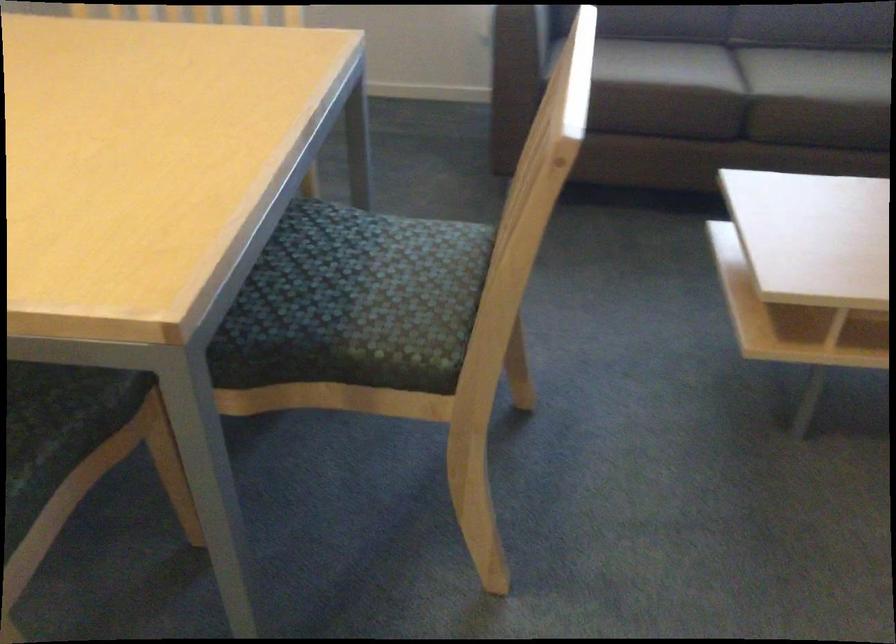
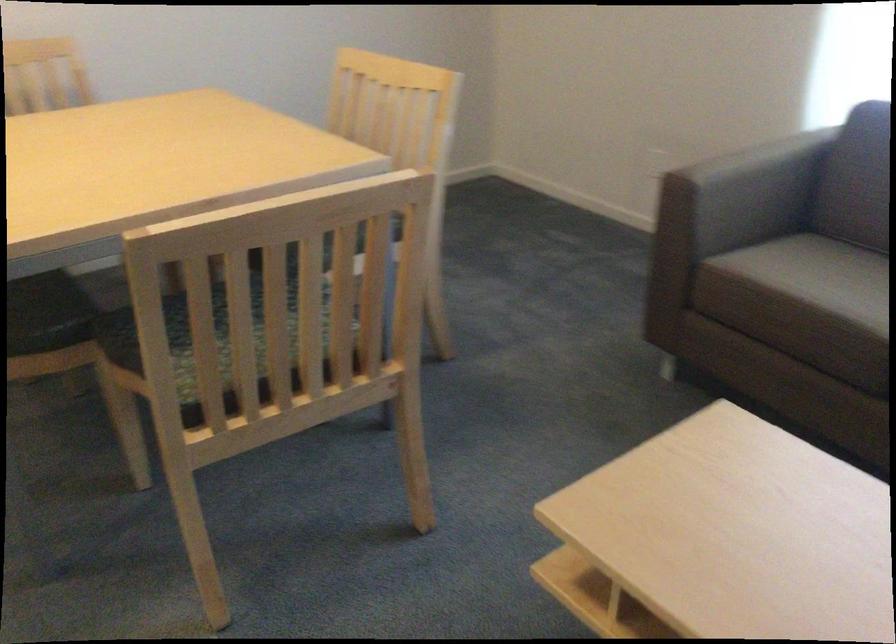
The point at (517, 259) is marked in the first image. Where is the corresponding point in the second image?

(211, 334)